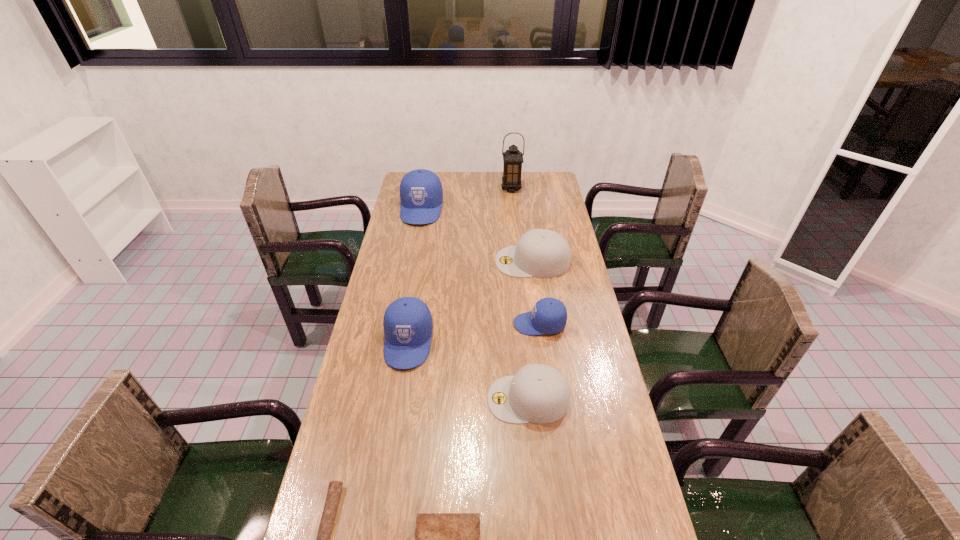
Identify the location of vacant area that lies between the second biggest blue cap and the smaller gray cap. (468, 370).

Where is `free point between the nearer gray cap and the smallest blue cap`? The height and width of the screenshot is (540, 960). free point between the nearer gray cap and the smallest blue cap is located at coordinates (534, 362).

Image resolution: width=960 pixels, height=540 pixels. I want to click on free spot between the second biggest blue cap and the nearest cap, so click(468, 370).

Where is `free space between the lantern and the nearest cap`? free space between the lantern and the nearest cap is located at coordinates (520, 294).

What are the coordinates of `free spot between the nearest cap and the rightmost blue cap` in the screenshot? It's located at (534, 362).

Where is `the closest object relative to the hammer`? The image size is (960, 540). the closest object relative to the hammer is located at coordinates (441, 539).

Identify which object is located as the third nearest to the hammer. Please provide its 2D coordinates. Your answer should be formatted as a tuple, i.e. [(x, y)], where the tuple contains the x and y coordinates of a point satisfying the conditions above.

[(538, 393)]

Image resolution: width=960 pixels, height=540 pixels. I want to click on the second closest cap to the lantern, so click(x=543, y=253).

Where is `the second closest cap to the rightmost blue cap`? The image size is (960, 540). the second closest cap to the rightmost blue cap is located at coordinates (543, 253).

The image size is (960, 540). In order to click on blue cap that is the third closest to the shortest object in this screenshot , I will do `click(421, 194)`.